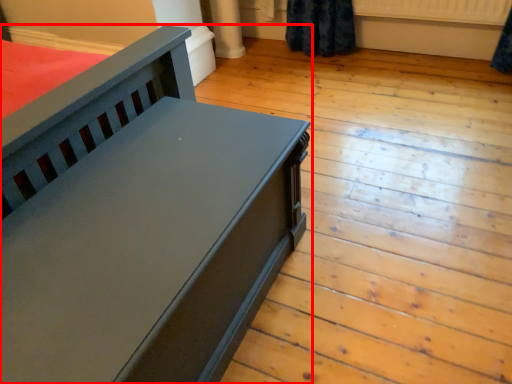
Question: In this image, where is furniture (annotated by the red box) located relative to radiator?

Choices:
 (A) left
 (B) right

Answer: (A)